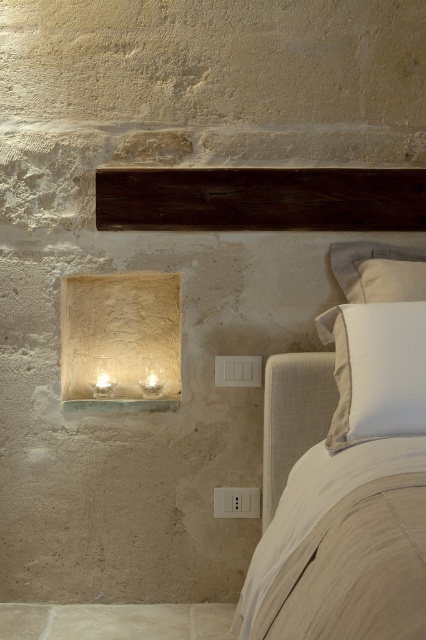
Is white linen pillow at upper right positioned in front of white plastic electric outlet at lower center?

Yes, white linen pillow at upper right is closer to the viewer.

Could you measure the distance between white linen pillow at upper right and white plastic electric outlet at lower center?

29.04 inches

Is point (379, 406) positioned before point (258, 492)?

Yes.

This screenshot has width=426, height=640. Identify the location of white linen pillow at upper right. (377, 371).

Looking at this image, does beige linen bed at right lie behind translucent glass lamp at lower left?

That is False.

Which is more to the left, beige linen bed at right or translucent glass lamp at lower left?

translucent glass lamp at lower left

Is point (319, 326) closer to camera compared to point (106, 376)?

Yes, point (319, 326) is closer to viewer.

Find the location of a particular element. The image size is (426, 640). beige linen bed at right is located at coordinates (351, 493).

Between white plastic electric outlet at lower center and translucent glass lamp at lower left, which one is positioned lower?

Positioned lower is white plastic electric outlet at lower center.

How far apart are white plastic electric outlet at lower center and translucent glass lamp at lower left?

49.08 centimeters

Is point (244, 493) positioned after point (109, 378)?

No, (244, 493) is closer to viewer.

Locate an element on the screen. The height and width of the screenshot is (640, 426). white plastic electric outlet at lower center is located at coordinates (236, 502).